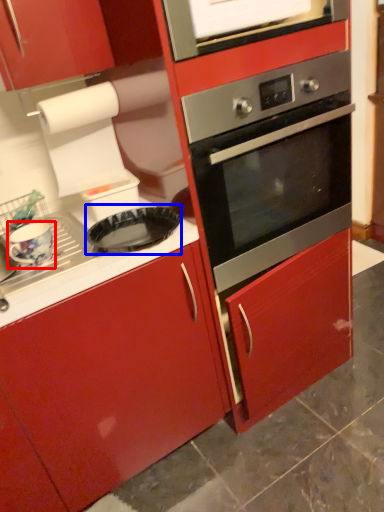
Question: Among these objects, which one is nearest to the camera, appliance (highlighted by a red box) or pizza pan (highlighted by a blue box)?

Choices:
 (A) appliance
 (B) pizza pan

Answer: (B)